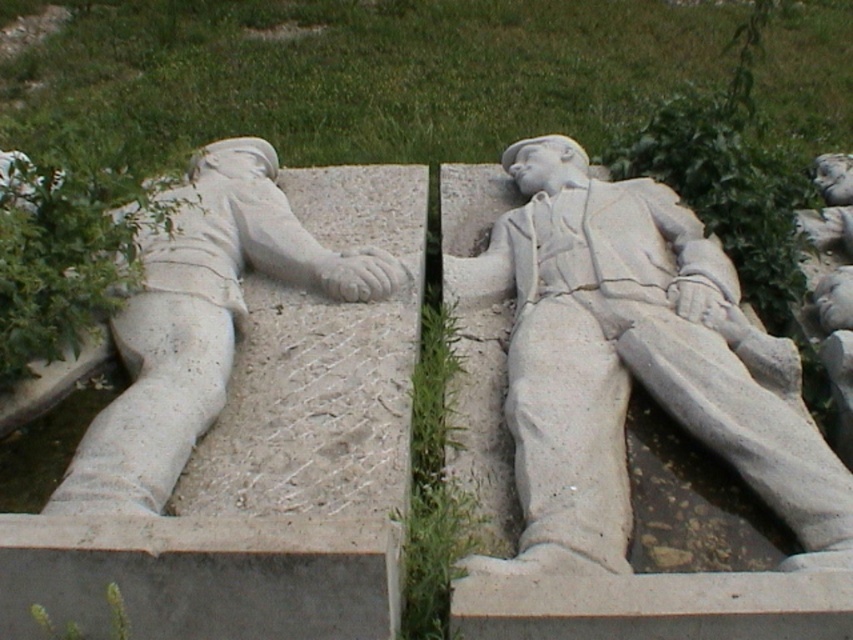
Which is more to the left, white stone statue at center or white stone statue at left?

Positioned to the left is white stone statue at left.

I want to click on white stone statue at center, so click(634, 364).